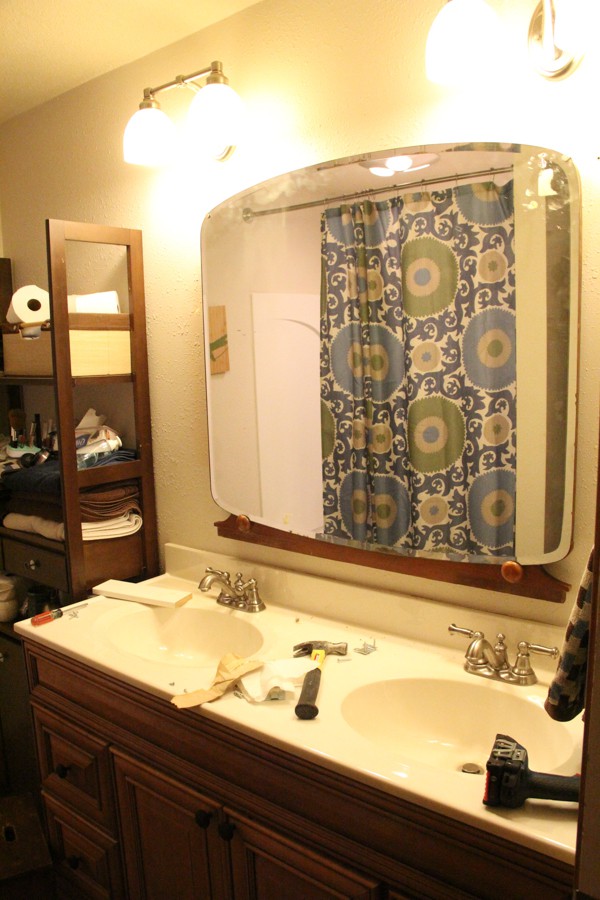
At what (x,y) coordinates should I click in order to perform the action: click on toilet paper. Please return your answer as a coordinate pair (x, y). The image size is (600, 900). Looking at the image, I should click on (26, 313).